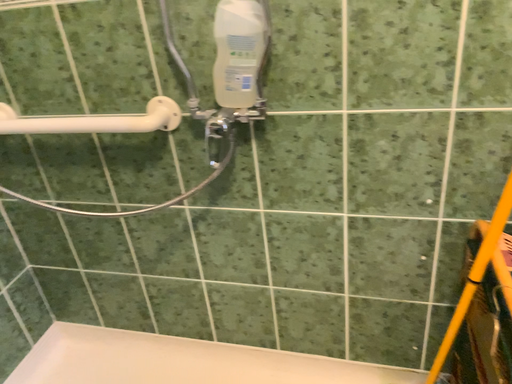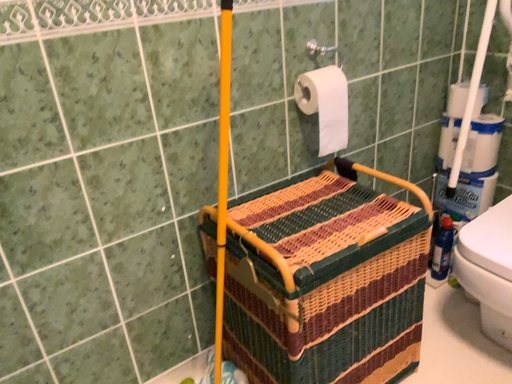
Question: How did the camera likely rotate when shooting the video?

Choices:
 (A) rotated downward
 (B) rotated upward

Answer: (B)